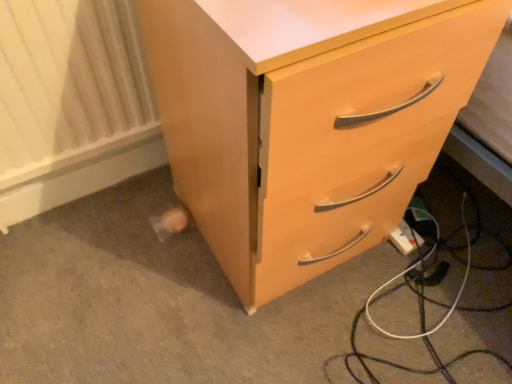
Question: Is white textured radiator at lower left positioned in front of matte wood chest of drawers at lower right?

Choices:
 (A) no
 (B) yes

Answer: (A)

Question: Is white textured radiator at lower left not within matte wood chest of drawers at lower right?

Choices:
 (A) no
 (B) yes

Answer: (B)

Question: Considering the relative sizes of white textured radiator at lower left and matte wood chest of drawers at lower right in the image provided, is white textured radiator at lower left smaller than matte wood chest of drawers at lower right?

Choices:
 (A) no
 (B) yes

Answer: (B)

Question: Can you confirm if white textured radiator at lower left is bigger than matte wood chest of drawers at lower right?

Choices:
 (A) yes
 (B) no

Answer: (B)

Question: Can you confirm if white textured radiator at lower left is taller than matte wood chest of drawers at lower right?

Choices:
 (A) no
 (B) yes

Answer: (A)

Question: Does white textured radiator at lower left contain matte wood chest of drawers at lower right?

Choices:
 (A) yes
 (B) no

Answer: (B)

Question: Considering the relative positions of matte wood chest of drawers at lower right and white plastic extension cord at lower right in the image provided, is matte wood chest of drawers at lower right to the left of white plastic extension cord at lower right from the viewer's perspective?

Choices:
 (A) yes
 (B) no

Answer: (A)

Question: Does matte wood chest of drawers at lower right have a lesser width compared to white plastic extension cord at lower right?

Choices:
 (A) no
 (B) yes

Answer: (A)

Question: From the image's perspective, does matte wood chest of drawers at lower right appear higher than white plastic extension cord at lower right?

Choices:
 (A) no
 (B) yes

Answer: (B)

Question: Is matte wood chest of drawers at lower right shorter than white plastic extension cord at lower right?

Choices:
 (A) no
 (B) yes

Answer: (A)

Question: Is matte wood chest of drawers at lower right taller than white plastic extension cord at lower right?

Choices:
 (A) no
 (B) yes

Answer: (B)

Question: Is matte wood chest of drawers at lower right positioned beyond the bounds of white plastic extension cord at lower right?

Choices:
 (A) yes
 (B) no

Answer: (A)

Question: Can you confirm if white plastic extension cord at lower right is positioned to the right of white textured radiator at lower left?

Choices:
 (A) no
 (B) yes

Answer: (B)